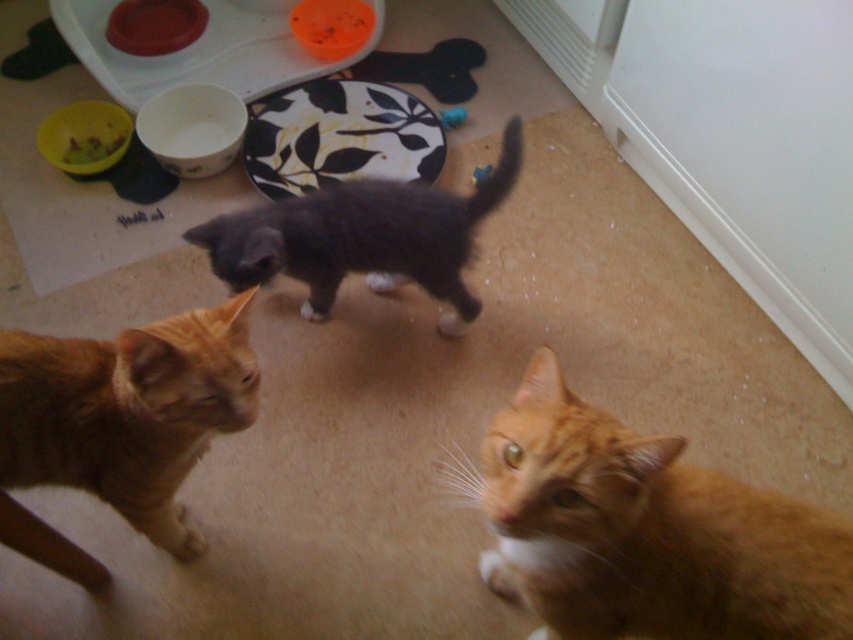
Question: Does orange fur cat at lower left have a greater width compared to blue rubber toy at center?

Choices:
 (A) yes
 (B) no

Answer: (A)

Question: Which of the following is the closest to the observer?

Choices:
 (A) (611, 628)
 (B) (13, 438)

Answer: (A)

Question: Considering the real-world distances, which object is closest to the rubberized yellow bowl at upper left?

Choices:
 (A) blue rubber toy at center
 (B) dark gray fur at center
 (C) orange fur cat at lower left

Answer: (B)

Question: Which point is farther from the camera taking this photo?

Choices:
 (A) (70, 157)
 (B) (476, 180)
 (C) (184, 429)
 (D) (442, 124)

Answer: (D)

Question: Does dark gray fur at center have a smaller size compared to blue rubber toy at center?

Choices:
 (A) no
 (B) yes

Answer: (A)

Question: Can you confirm if orange fur cat at lower left is wider than rubberized yellow bowl at upper left?

Choices:
 (A) no
 (B) yes

Answer: (B)